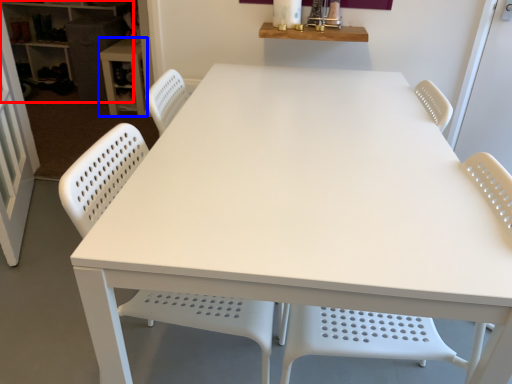
Question: Which point is further to the camera, shelf (highlighted by a red box) or table (highlighted by a blue box)?

Choices:
 (A) shelf
 (B) table

Answer: (A)